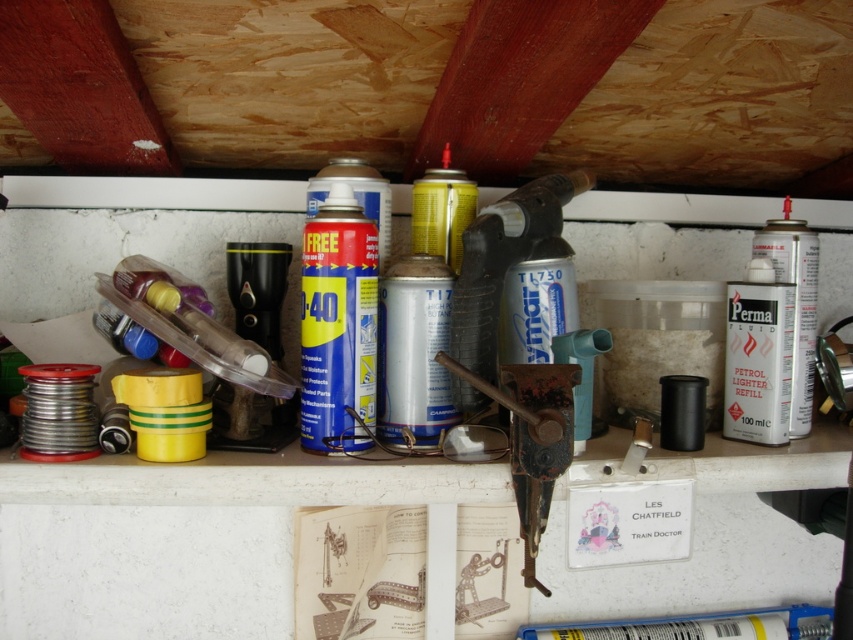
From the picture: You need to fit both the silver metallic spray can at center and the yellow matte spray can at center into a storage box that can only hold items taking up the same amount of space. Based on the shelf layout, which spray can should you remove to make room?

The silver metallic spray can at center occupies less space than the yellow matte spray can at center, so you should remove the yellow matte spray can at center to make room for the other one.

You are a maintenance worker needing to reach the white matte canister at right on the cluttered shelf. The tool you are holding is 28 inches long. Can you safely extend your arm to grab it without overreaching?

The white matte canister at right is 31.07 inches away from the camera. Since your tool is only 28 inches long, you cannot safely reach it without overextending your arm.

You are a delivery robot with a height of 28 inches. You need to place a package on a shelf in the workshop. The shelf has a point at coordinate point (311, 285). Can you safely place the package there without hitting your head?

The distance of point (311, 285) from the camera is 28.38 inches. Since the robot is 28 inches tall, there is a clearance of 0.38 inches. This is insufficient for safe placement as the robot might hit its head. Choose a higher point.